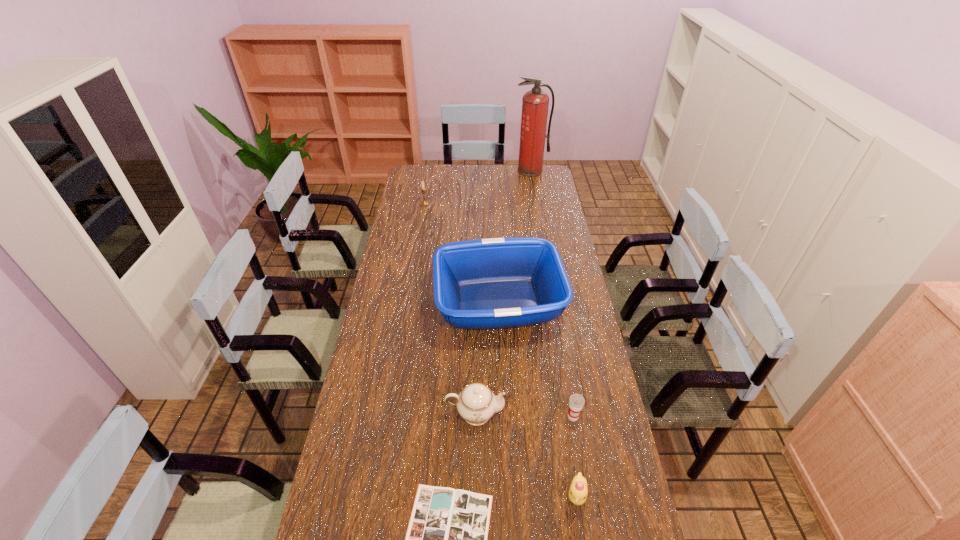
Where is `free space located on the right of the fifth nearest object`? free space located on the right of the fifth nearest object is located at coordinates (582, 303).

Locate an element on the screen. This screenshot has width=960, height=540. vacant region located 0.170m on the front of the leftmost object is located at coordinates (420, 226).

This screenshot has height=540, width=960. I want to click on vacant space positioned 0.290m on the side of the cup with the logo, so click(592, 530).

You are a GUI agent. You are given a task and a screenshot of the screen. Output one action in this format:
    pyautogui.click(x=<x>, y=<y>)
    Task: Click on the vacant position located 0.090m at the spout of the chinaware
    
    Given the screenshot: What is the action you would take?
    pyautogui.click(x=535, y=413)

Image resolution: width=960 pixels, height=540 pixels. I want to click on vacant area located 0.050m on the front-facing side of the duckling, so click(x=583, y=534).

You are a GUI agent. You are given a task and a screenshot of the screen. Output one action in this format:
    pyautogui.click(x=<x>, y=<y>)
    Task: Click on the object present at the far edge
    
    Given the screenshot: What is the action you would take?
    pyautogui.click(x=535, y=103)

Locate an element on the screen. The image size is (960, 540). object located at the left edge is located at coordinates (423, 203).

You are a GUI agent. You are given a task and a screenshot of the screen. Output one action in this format:
    pyautogui.click(x=<x>, y=<y>)
    Task: Click on the fire extinguisher at the right edge
    Image resolution: width=960 pixels, height=540 pixels.
    Given the screenshot: What is the action you would take?
    pyautogui.click(x=535, y=103)

At what (x,y) coordinates should I click in order to perform the action: click on tray at the right edge. Please return your answer as a coordinate pair (x, y). Looking at the image, I should click on (492, 283).

Identify the location of cup located at the right edge. (576, 401).